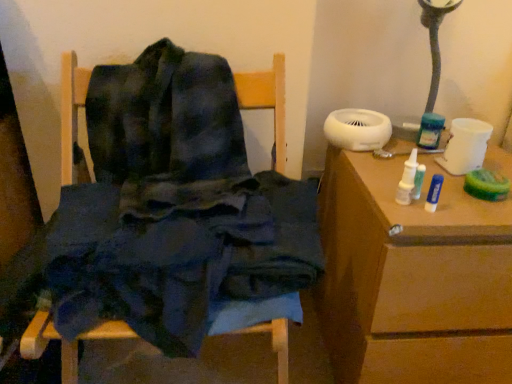
Question: Do you think dark blue fabric at center is within brown wooden table at right, or outside of it?

Choices:
 (A) outside
 (B) inside

Answer: (A)

Question: Based on their positions, is dark blue fabric at center located to the left or right of brown wooden table at right?

Choices:
 (A) left
 (B) right

Answer: (A)

Question: From the image's perspective, relative to brown wooden table at right, is dark blue fabric at center above or below?

Choices:
 (A) above
 (B) below

Answer: (A)

Question: In terms of width, does brown wooden table at right look wider or thinner when compared to dark blue fabric at center?

Choices:
 (A) wide
 (B) thin

Answer: (A)

Question: From a real-world perspective, is brown wooden table at right physically located above or below dark blue fabric at center?

Choices:
 (A) below
 (B) above

Answer: (A)

Question: Is point (490, 306) positioned closer to the camera than point (273, 97)?

Choices:
 (A) farther
 (B) closer

Answer: (B)

Question: Would you say brown wooden table at right is to the left or to the right of dark blue fabric at center in the picture?

Choices:
 (A) left
 (B) right

Answer: (B)